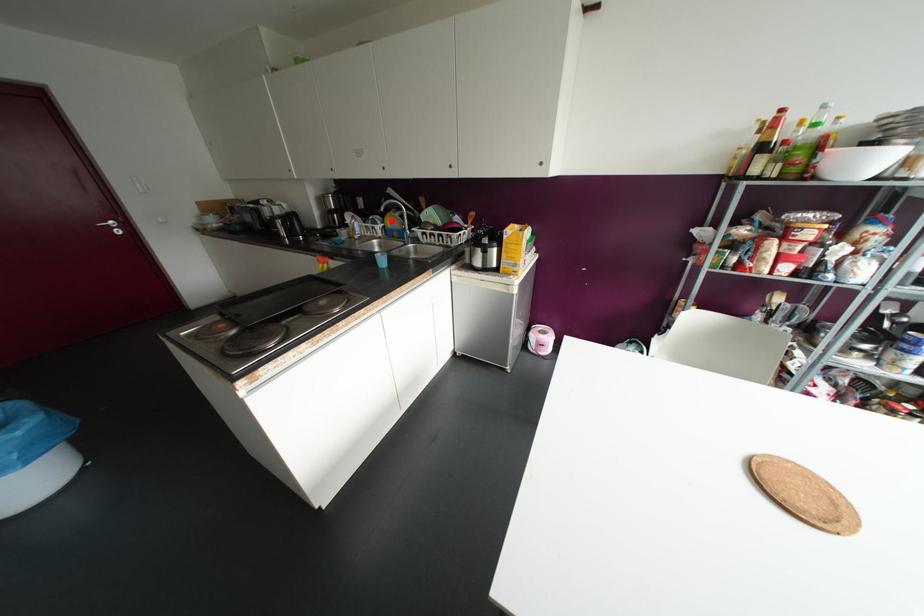
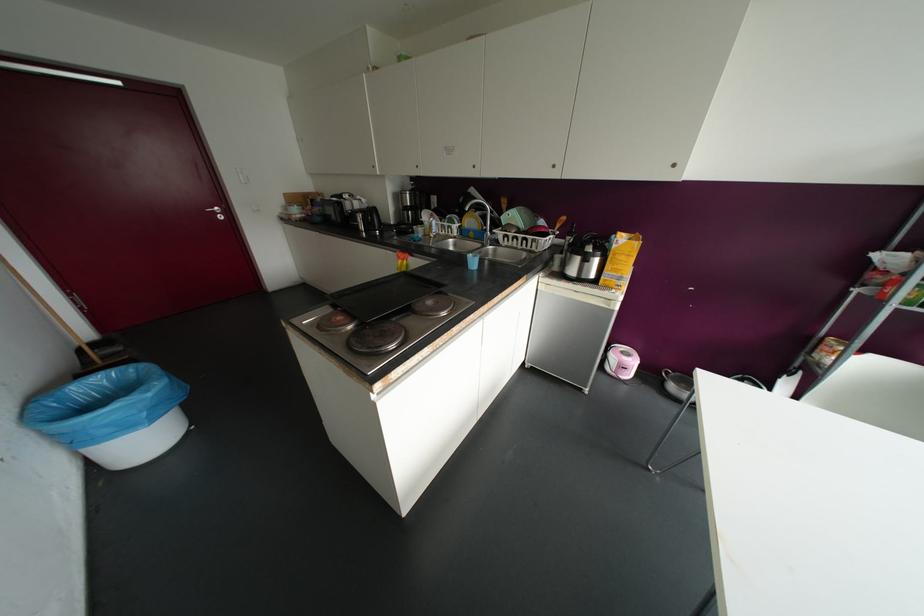
Where in the second image is the point corresponding to the highlighted location from the first image?

(469, 221)